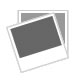
Find the location of a particular element. This screenshot has height=80, width=80. computer moniter is located at coordinates (46, 42).